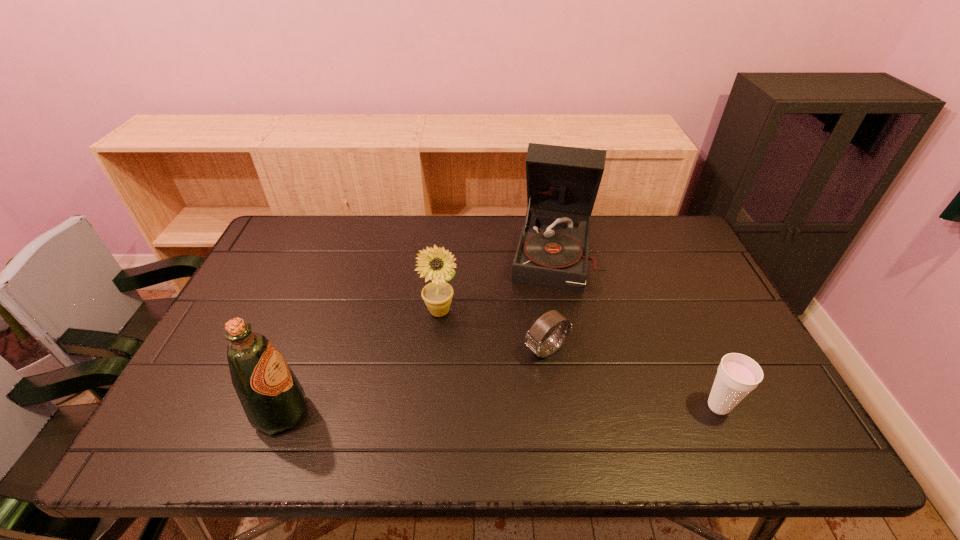
Locate an element on the screen. vacant space on the desktop that is between the fourth shortest object and the cup and is positioned on the face of the sunflower is located at coordinates (532, 409).

In order to click on vacant space on the desktop that is between the olive oil and the second shortest object and is positioned on the face of the shortest object in this screenshot , I will do `click(452, 410)`.

Where is `free spot on the desktop that is between the leftmost object and the second shortest object and is positioned on the front-facing side of the farthest object`? This screenshot has width=960, height=540. free spot on the desktop that is between the leftmost object and the second shortest object and is positioned on the front-facing side of the farthest object is located at coordinates (527, 409).